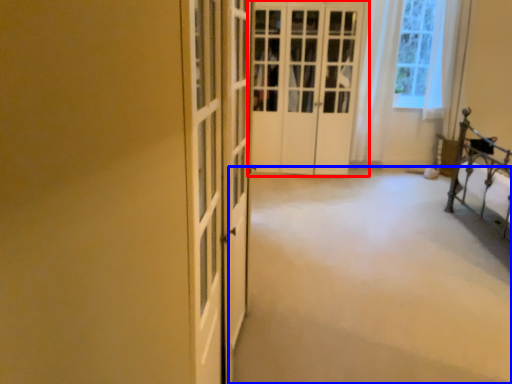
Question: Among these objects, which one is farthest to the camera, door (highlighted by a red box) or plain (highlighted by a blue box)?

Choices:
 (A) door
 (B) plain

Answer: (A)